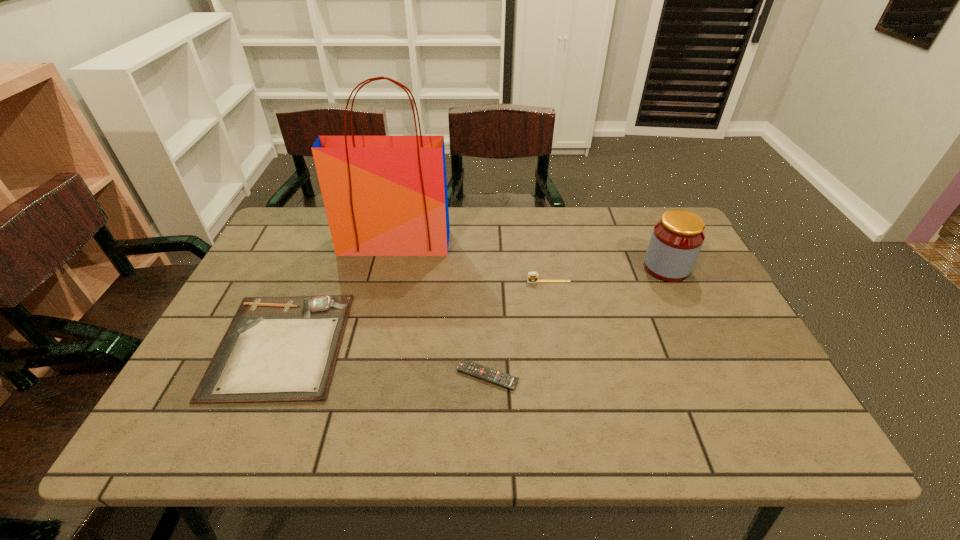
Image resolution: width=960 pixels, height=540 pixels. Find the location of `object that is the second closest to the second shortest object`. object that is the second closest to the second shortest object is located at coordinates (507, 381).

You are a GUI agent. You are given a task and a screenshot of the screen. Output one action in this format:
    pyautogui.click(x=<x>, y=<y>)
    Task: Click on the object that is the fourth closest to the rightmost object
    
    Given the screenshot: What is the action you would take?
    pyautogui.click(x=276, y=349)

This screenshot has width=960, height=540. I want to click on vacant space that satisfies the following two spatial constraints: 1. on the handle side of the shopping bag; 2. on the left side of the remote control, so click(x=364, y=376).

Image resolution: width=960 pixels, height=540 pixels. Find the location of `vacant space that satisfies the following two spatial constraints: 1. on the back side of the fourth shortest object; 2. on the left side of the third object from right to left`. vacant space that satisfies the following two spatial constraints: 1. on the back side of the fourth shortest object; 2. on the left side of the third object from right to left is located at coordinates (486, 268).

Find the location of a particular element. The image size is (960, 540). free space that satisfies the following two spatial constraints: 1. on the front side of the third object from left to right; 2. on the left side of the clipboard is located at coordinates click(x=268, y=376).

At what (x,y) coordinates should I click in order to perform the action: click on vacant area in the image that satisfies the following two spatial constraints: 1. on the back side of the rightmost object; 2. on the right side of the third object from left to right. Please return your answer as a coordinate pair (x, y). The image size is (960, 540). Looking at the image, I should click on (486, 268).

At what (x,y) coordinates should I click in order to perform the action: click on blank area in the image that satisfies the following two spatial constraints: 1. on the handle side of the remote control; 2. on the left side of the shopping bag. Please return your answer as a coordinate pair (x, y). The image size is (960, 540). Looking at the image, I should click on (364, 376).

What are the coordinates of `free region that satisfies the following two spatial constraints: 1. on the back side of the fourth shortest object; 2. on the left side of the third object from left to right` in the screenshot? It's located at (486, 268).

You are a GUI agent. You are given a task and a screenshot of the screen. Output one action in this format:
    pyautogui.click(x=<x>, y=<y>)
    Task: Click on the vacant region that satisfies the following two spatial constraints: 1. on the handle side of the shopping bag; 2. on the right side of the jar
    This screenshot has width=960, height=540.
    Given the screenshot: What is the action you would take?
    pyautogui.click(x=389, y=268)